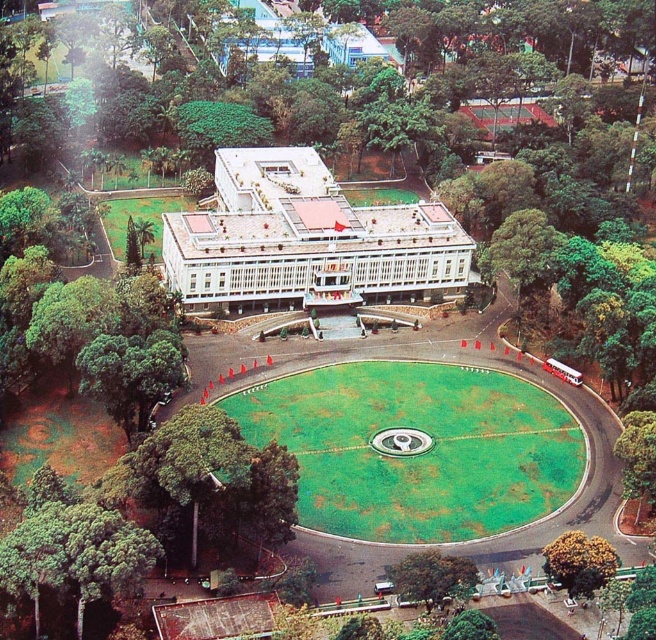
Question: Which of these objects is positioned farthest from the green grass at center?

Choices:
 (A) green leafy tree at lower right
 (B) green grass lawn at left
 (C) green leafy tree at lower left

Answer: (B)

Question: Observing the image, what is the correct spatial positioning of green grass at center in reference to yellow-green leafy tree at lower right?

Choices:
 (A) left
 (B) right

Answer: (A)

Question: Which point is closer to the camera?

Choices:
 (A) (142, 550)
 (B) (148, 243)
 (C) (241, 269)

Answer: (A)

Question: Based on their relative distances, which object is nearer to the green leafy tree at lower right?

Choices:
 (A) yellow-green leafy tree at lower right
 (B) green grass at center
 (C) white glossy building at center
 (D) green grass lawn at left

Answer: (A)

Question: Can you confirm if green grass at center is smaller than green leafy tree at lower left?

Choices:
 (A) yes
 (B) no

Answer: (B)

Question: Does yellow-green leafy tree at lower right appear over green leafy tree at lower right?

Choices:
 (A) yes
 (B) no

Answer: (B)